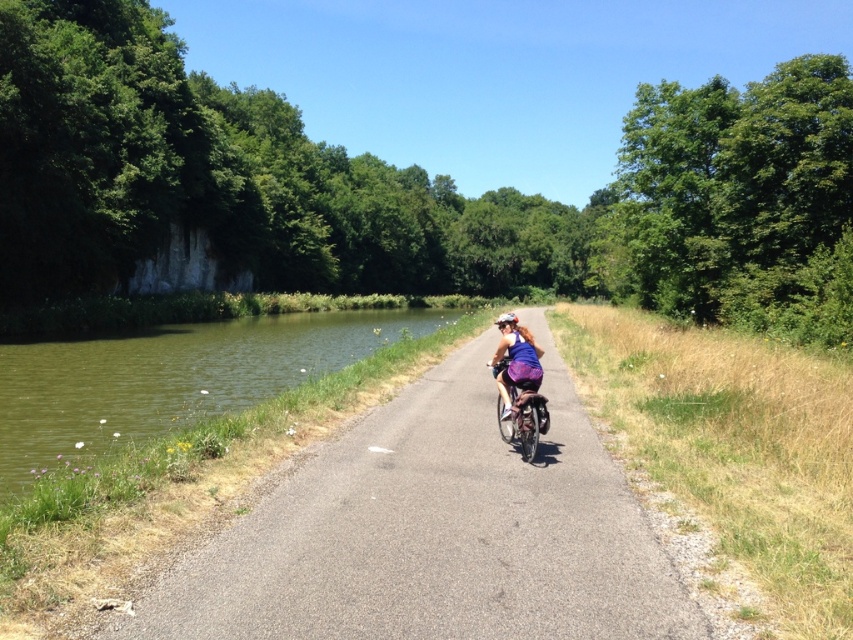
Is asphalt road at center to the left of green grassy river at left from the viewer's perspective?

In fact, asphalt road at center is to the right of green grassy river at left.

Does asphalt road at center appear under green grassy river at left?

Yes, asphalt road at center is below green grassy river at left.

Describe the element at coordinates (434, 532) in the screenshot. I see `asphalt road at center` at that location.

This screenshot has height=640, width=853. What are the coordinates of `asphalt road at center` in the screenshot? It's located at (434, 532).

Where is `purple fabric helmet at center`? purple fabric helmet at center is located at coordinates (515, 360).

Can you confirm if purple fabric helmet at center is smaller than metallic silver bicycle at center?

Incorrect, purple fabric helmet at center is not smaller in size than metallic silver bicycle at center.

Find the location of a particular element. This screenshot has height=640, width=853. purple fabric helmet at center is located at coordinates (515, 360).

Is point (115, 634) positioned in front of point (529, 385)?

Yes, point (115, 634) is closer to viewer.

Does asphalt road at center appear on the left side of metallic silver bicycle at center?

No, asphalt road at center is not to the left of metallic silver bicycle at center.

Is point (364, 552) positioned before point (531, 422)?

Yes, point (364, 552) is in front of point (531, 422).

At what (x,y) coordinates should I click in order to perform the action: click on asphalt road at center. Please return your answer as a coordinate pair (x, y). Image resolution: width=853 pixels, height=640 pixels. Looking at the image, I should click on (434, 532).